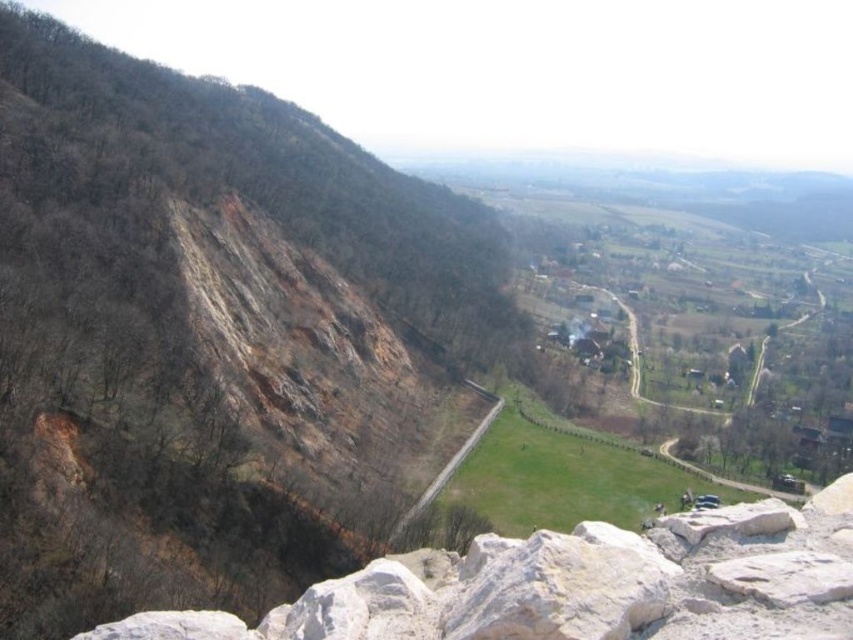
Question: Is white rough rock at lower left in front of green grassy field at center?

Choices:
 (A) no
 (B) yes

Answer: (B)

Question: Which point is closer to the camera?

Choices:
 (A) (500, 401)
 (B) (785, 566)

Answer: (B)

Question: From the image, what is the correct spatial relationship of white rough rock at lower left in relation to green grassy field at center?

Choices:
 (A) right
 (B) left

Answer: (A)

Question: Which of the following is the closest to the observer?

Choices:
 (A) (488, 426)
 (B) (799, 572)

Answer: (B)

Question: Does white rough rock at lower left lie behind green grassy field at center?

Choices:
 (A) no
 (B) yes

Answer: (A)